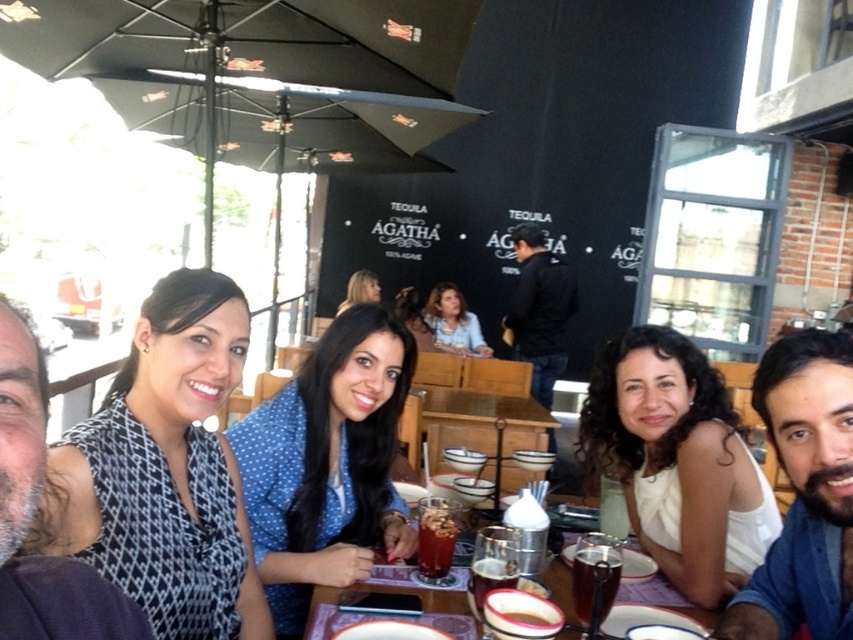
Is point (440, 305) closer to viewer compared to point (520, 612)?

No.

Describe the element at coordinates (453, 323) in the screenshot. Image resolution: width=853 pixels, height=640 pixels. I see `matte blue shirt at center` at that location.

Is point (428, 320) positioned in front of point (503, 612)?

That is False.

Locate an element on the screen. This screenshot has width=853, height=640. matte blue shirt at center is located at coordinates (453, 323).

Can you confirm if wooden table at center is positioned to the left of translucent glass cup at table center?

Incorrect, wooden table at center is not on the left side of translucent glass cup at table center.

Who is positioned more to the left, wooden table at center or translucent glass cup at table center?

From the viewer's perspective, translucent glass cup at table center appears more on the left side.

Is point (674, 595) more distant than point (479, 609)?

That is True.

Locate an element on the screen. wooden table at center is located at coordinates (672, 600).

Is white satin dress at center smaller than blonde hair at center?

No.

Is point (602, 385) closer to camera compared to point (375, 289)?

Yes, point (602, 385) is in front of point (375, 289).

Between point (757, 477) and point (345, 301), which one is positioned behind?

The point (345, 301) is behind.

Where is `white satin dress at center`? white satin dress at center is located at coordinates click(x=677, y=461).